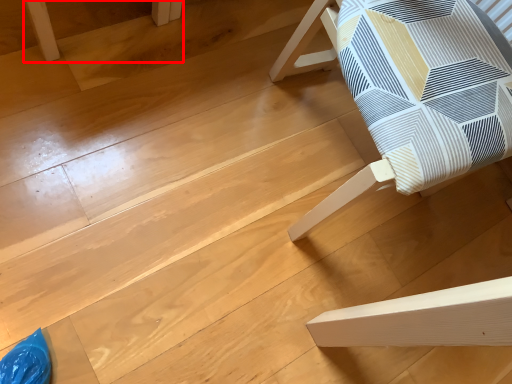
Question: Where is furniture (annotated by the red box) located in relation to furniture in the image?

Choices:
 (A) left
 (B) right

Answer: (A)